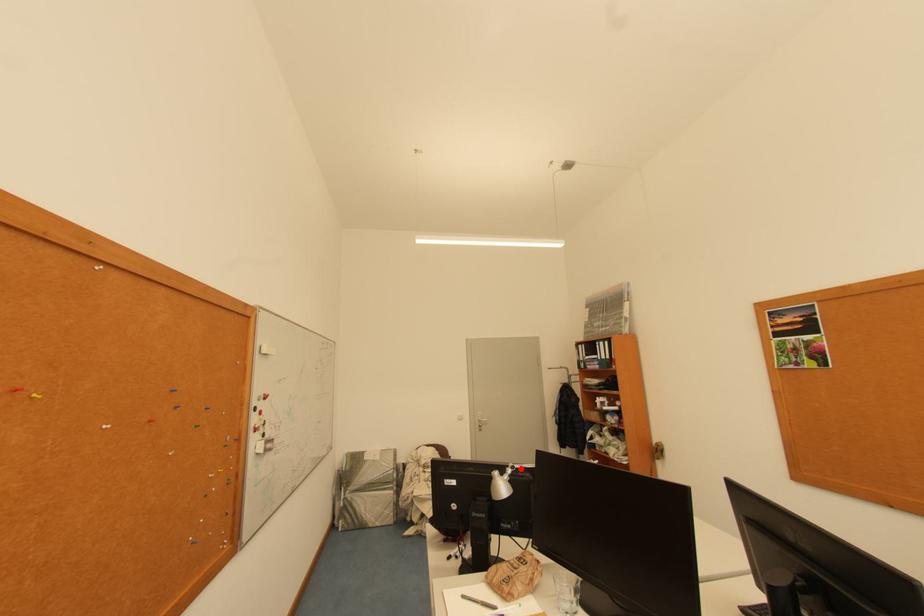
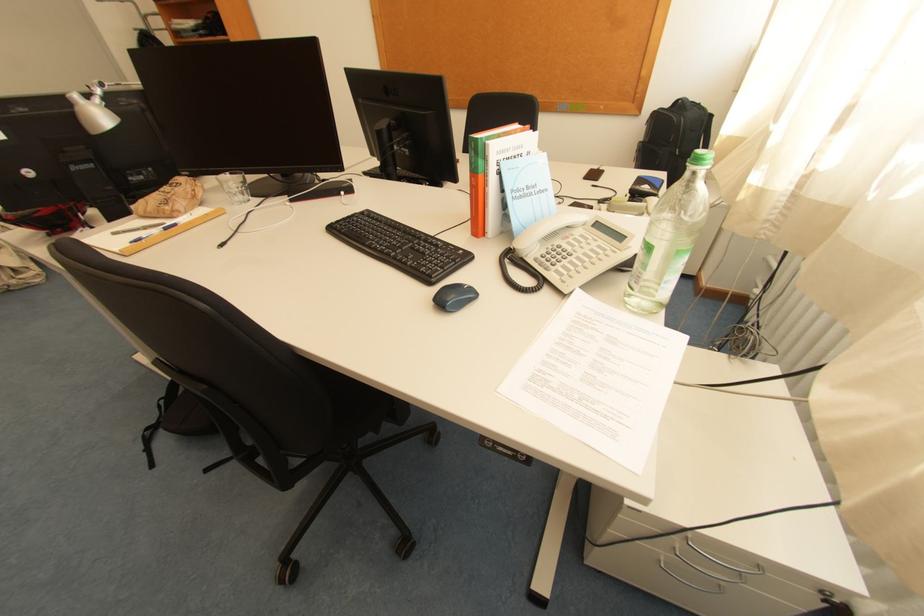
The point at the highlighted location is marked in the first image. Where is the corresponding point in the second image?

(110, 86)